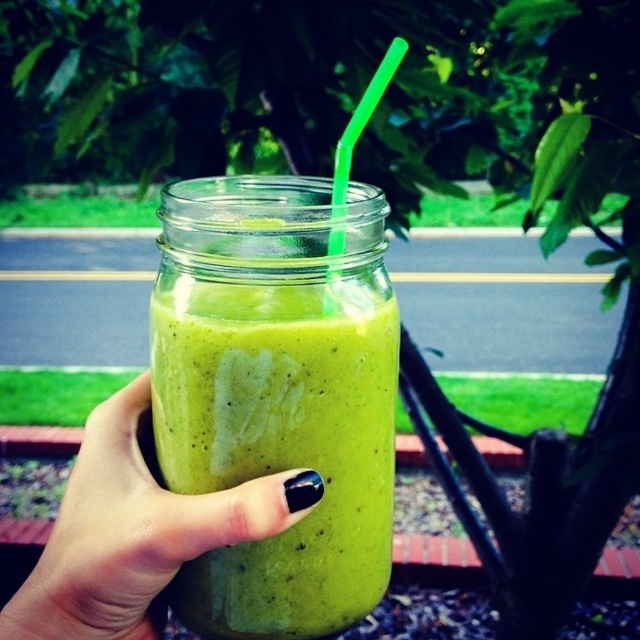
Who is more forward, (250,340) or (164,548)?

Point (164,548) is more forward.

Where is `green matte glass jar at center`? green matte glass jar at center is located at coordinates (276, 392).

Find the location of a particular element. green matte glass jar at center is located at coordinates (276, 392).